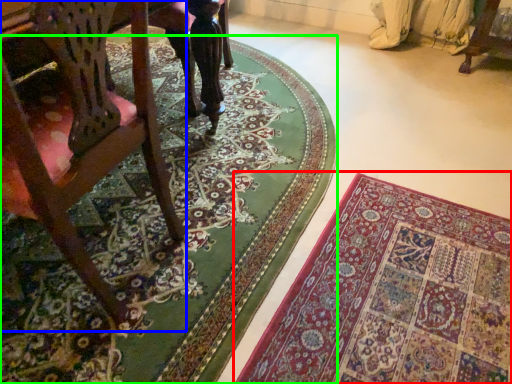
Question: Based on their relative distances, which object is farther from mat (highlighted by a red box)? Choose from chair (highlighted by a blue box) and mat (highlighted by a green box).

Choices:
 (A) chair
 (B) mat

Answer: (A)